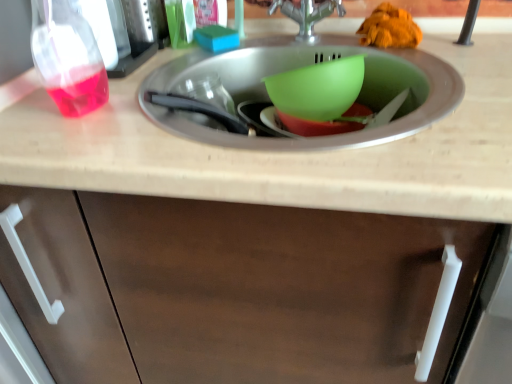
You are a GUI agent. You are given a task and a screenshot of the screen. Output one action in this format:
    pyautogui.click(x=<x>, y=<y>)
    Task: Click on the free space that is in between blue sponge at upper center, which appears as the second food when viewed from the right, and orange fuzzy sponge at upper right, the first food viewed from the right
    The width and height of the screenshot is (512, 384).
    Given the screenshot: What is the action you would take?
    pyautogui.click(x=295, y=47)